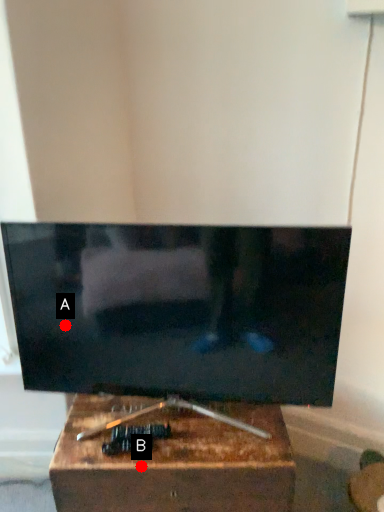
Question: Two points are circled on the image, labeled by A and B beside each circle. Among these points, which one is nearest to the camera?

Choices:
 (A) A is closer
 (B) B is closer

Answer: (B)